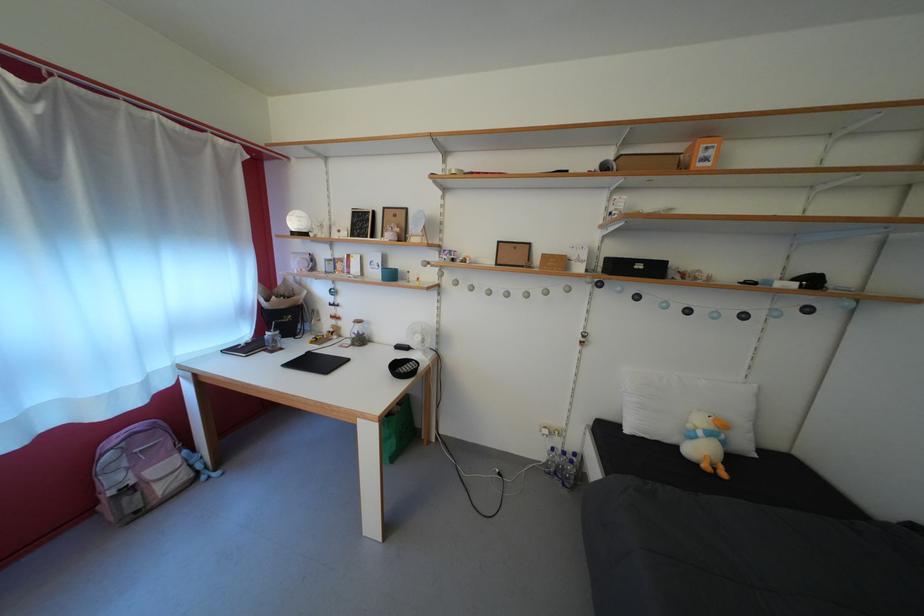
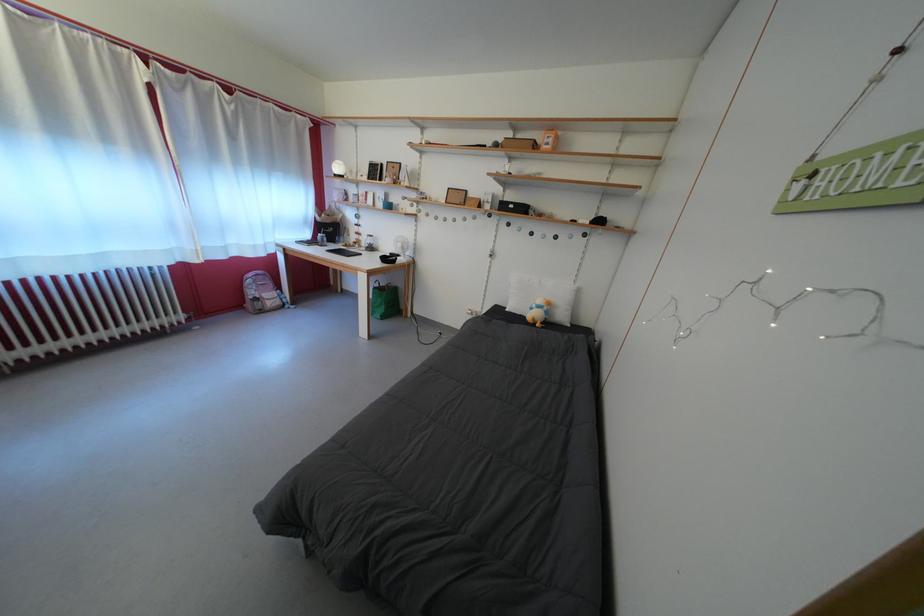
Question: I am providing you with two images of the same scene from different viewpoints. Which of the following objects are not visible in image2?

Choices:
 (A) green tote bag
 (B) small black box
 (C) round white lamp
 (D) none of these

Answer: (D)